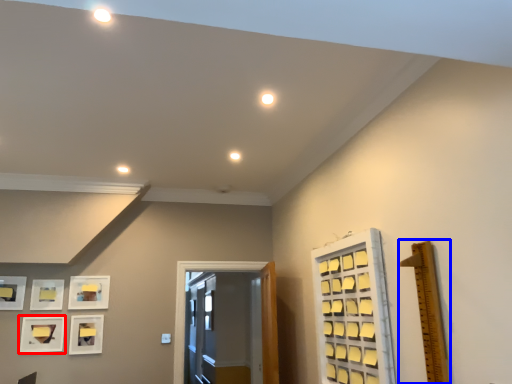
Question: Which object appears closest to the camera in this image, picture frame (highlighted by a red box) or ruler (highlighted by a blue box)?

Choices:
 (A) picture frame
 (B) ruler

Answer: (B)